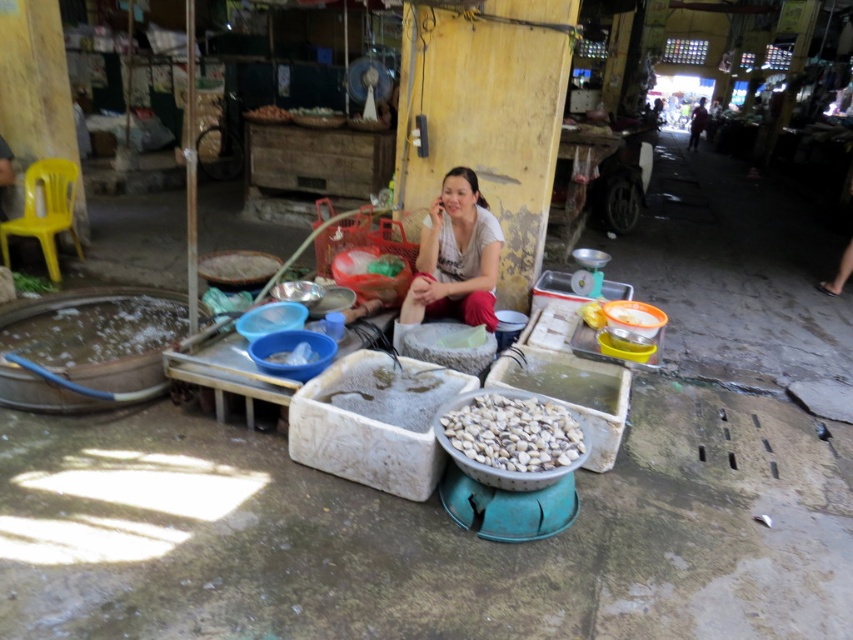
You are a customer in the market and want to buy the white cotton shirt at center. Where should you look to find it?

The white cotton shirt at center is located at the 2D coordinates point (456,257).

You are a customer at the market and want to pick up both the white cotton shirt at center and the white matte bowl at center. How far apart are these two items?

The white cotton shirt at center and white matte bowl at center are 38.85 inches apart.